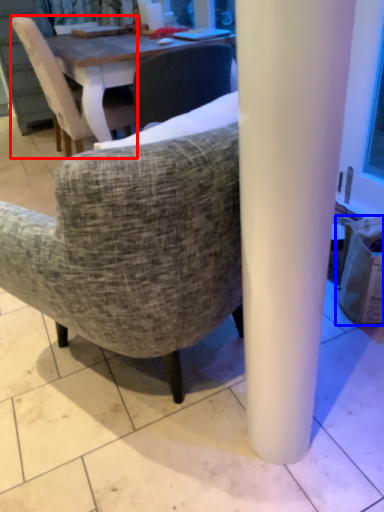
Question: Which of the following is the closest to the observer, chair (highlighted by a red box) or trash bin/can (highlighted by a blue box)?

Choices:
 (A) chair
 (B) trash bin/can

Answer: (B)